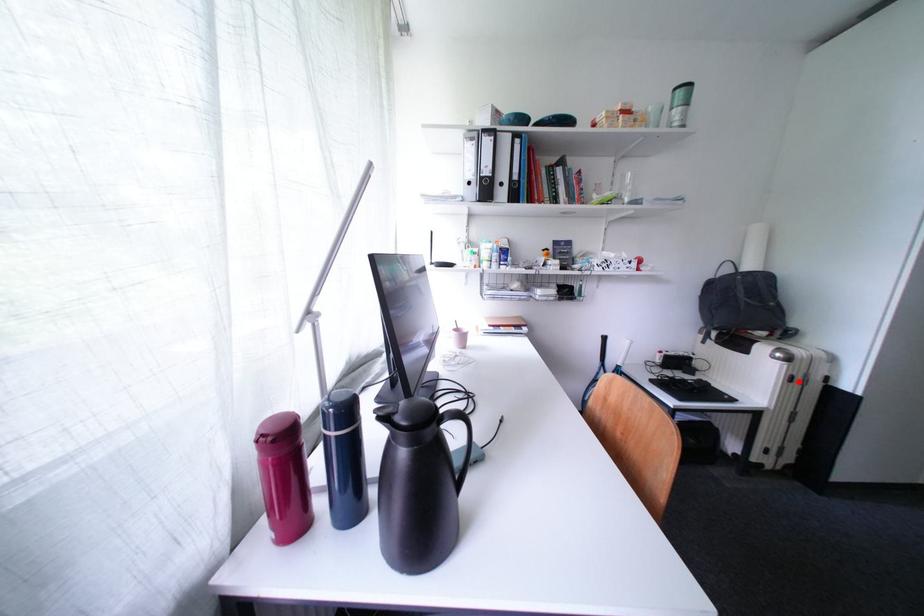
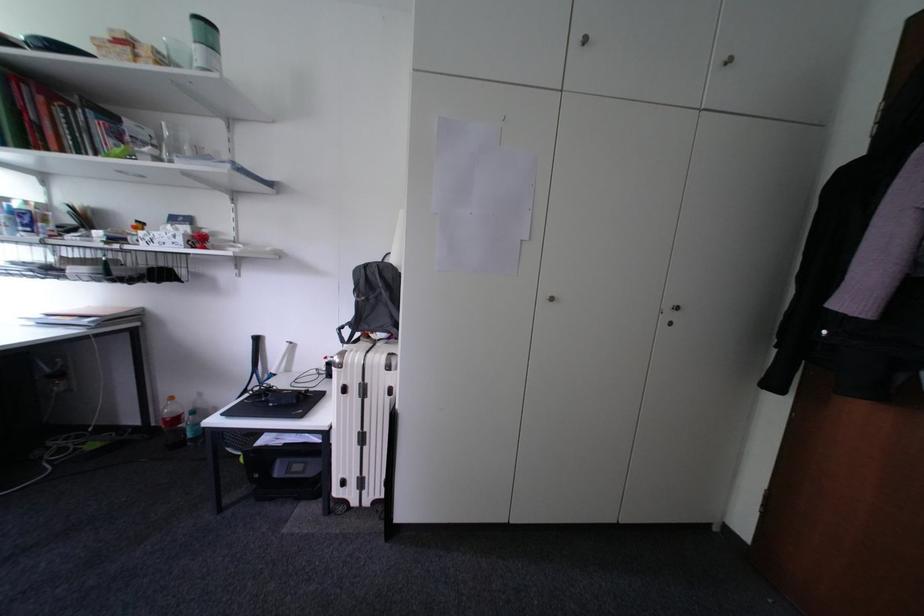
Find the pixel in the second image that matches the highlighted location in the first image.

(353, 392)